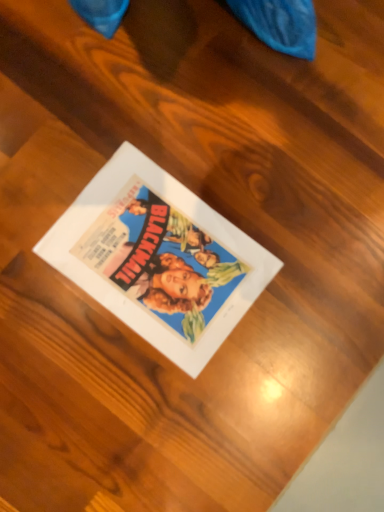
Locate an element on the screen. vacant area situated to the left side of matte paper poster at center is located at coordinates (42, 194).